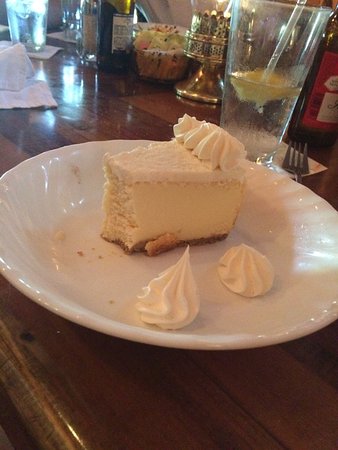
At what (x,y) coordinates should I click in order to perform the action: click on countertop. Please return your answer as a coordinate pair (x, y). This screenshot has height=450, width=338. Looking at the image, I should click on (134, 409).